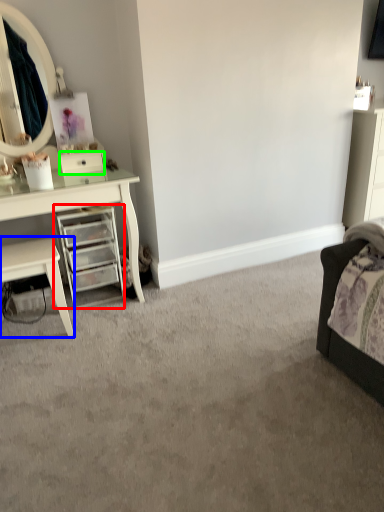
Question: Which object is the closest to the chest of drawers (highlighted by a red box)? Choose among these: nightstand (highlighted by a blue box) or drawer (highlighted by a green box).

Choices:
 (A) nightstand
 (B) drawer

Answer: (A)